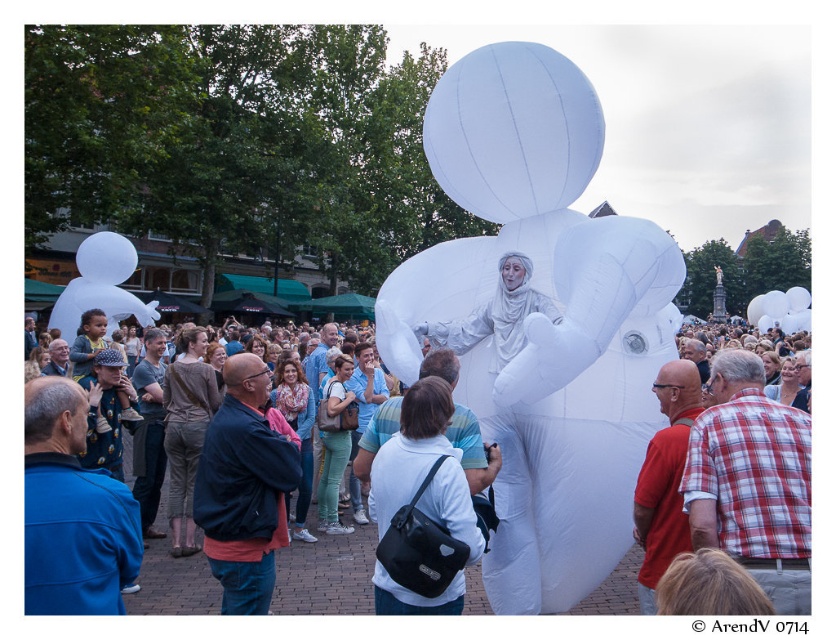
Question: Can you confirm if white inflatable figure at center is bigger than white matte balloon at upper center?

Choices:
 (A) yes
 (B) no

Answer: (A)

Question: Where is white inflatable figure at center located in relation to white matte bag at center in the image?

Choices:
 (A) below
 (B) above

Answer: (B)

Question: Which point appears closest to the camera in this image?

Choices:
 (A) (467, 508)
 (B) (595, 124)

Answer: (A)

Question: Which is nearer to the white inflatable figure at center?

Choices:
 (A) white matte balloon at left
 (B) white matte bag at center

Answer: (B)

Question: Which of the following is the farthest from the observer?

Choices:
 (A) (528, 420)
 (B) (126, 300)
 (C) (495, 49)
 (D) (439, 449)

Answer: (B)

Question: Considering the relative positions of white inflatable figure at center and white matte balloon at left in the image provided, where is white inflatable figure at center located with respect to white matte balloon at left?

Choices:
 (A) above
 (B) below

Answer: (B)